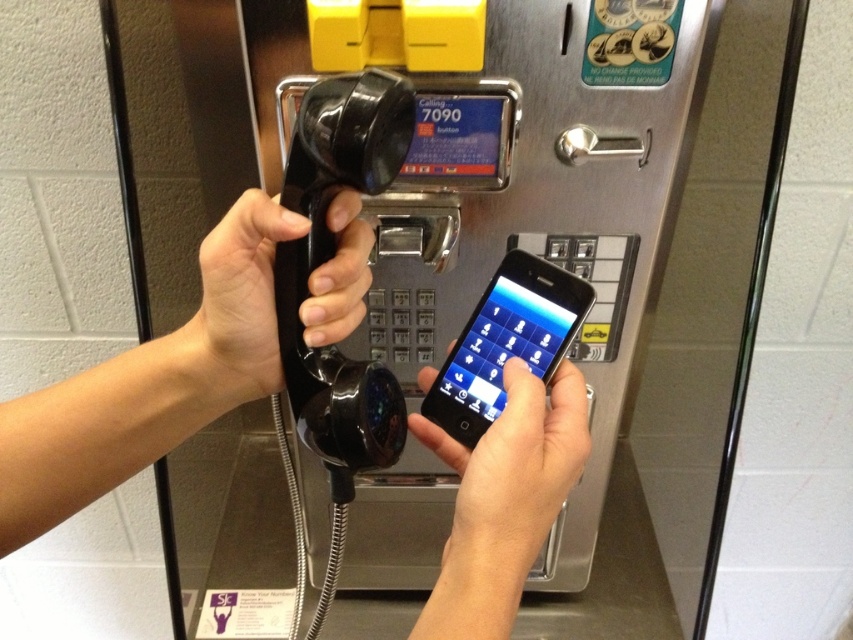
Question: Which object appears farthest from the camera in this image?

Choices:
 (A) black rubberized phone at center
 (B) metallic gray payphone at center
 (C) black glossy smartphone at center
 (D) matte black phone at center

Answer: (B)

Question: Considering the real-world distances, which object is closest to the black glossy smartphone at center?

Choices:
 (A) metallic gray payphone at center
 (B) matte black phone at center

Answer: (B)

Question: Which of the following is the closest to the observer?

Choices:
 (A) matte black phone at center
 (B) black glossy smartphone at center

Answer: (A)

Question: Does matte black phone at center have a greater width compared to black glossy smartphone at center?

Choices:
 (A) yes
 (B) no

Answer: (A)

Question: Can you confirm if metallic gray payphone at center is positioned below black glossy smartphone at center?

Choices:
 (A) yes
 (B) no

Answer: (A)

Question: Does black matte phone at center lie behind black rubberized phone at center?

Choices:
 (A) yes
 (B) no

Answer: (B)